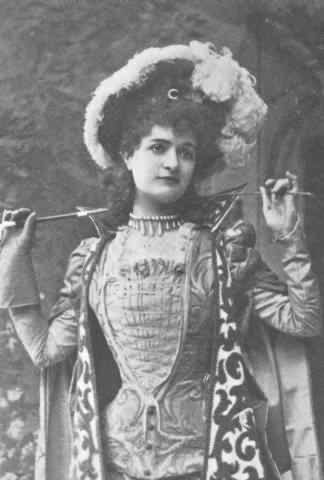
Locate an element on the screen. paisley wallpaper is located at coordinates (64, 88).